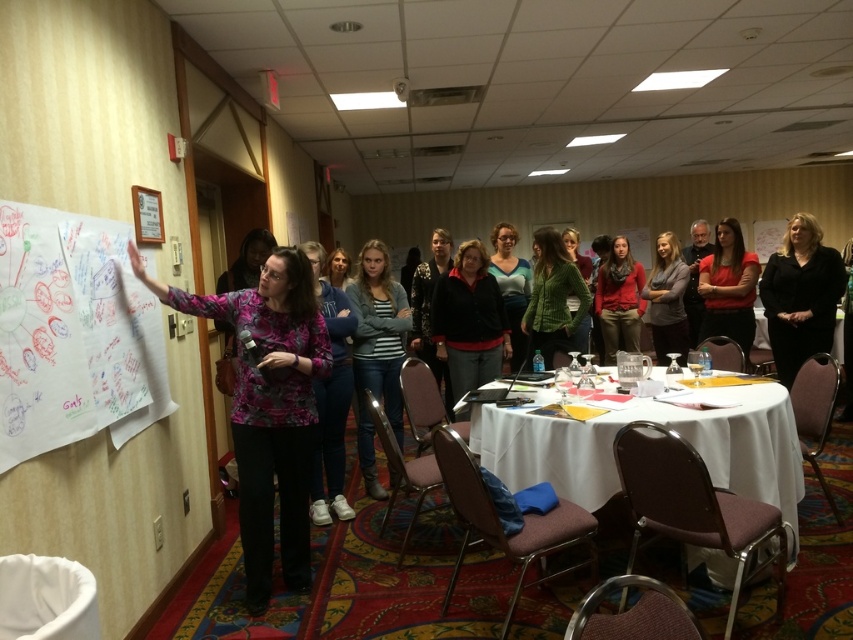
Between matte red sweater at center and matte blue shirt at center, which one appears on the left side from the viewer's perspective?

From the viewer's perspective, matte blue shirt at center appears more on the left side.

Describe the element at coordinates (619, 300) in the screenshot. I see `matte red sweater at center` at that location.

This screenshot has width=853, height=640. I want to click on matte red sweater at center, so click(x=619, y=300).

Between matte red sweater at center and matte pink blouse at center, which one has less height?

matte pink blouse at center is shorter.

What do you see at coordinates (619, 300) in the screenshot?
I see `matte red sweater at center` at bounding box center [619, 300].

At what (x,y) coordinates should I click in order to perform the action: click on matte red sweater at center. Please return your answer as a coordinate pair (x, y). Looking at the image, I should click on (619, 300).

Which is in front, point (726, 294) or point (325, 266)?

Positioned in front is point (325, 266).

Is point (732, 330) less distant than point (340, 253)?

No, it is behind (340, 253).

Find the location of a particular element. This screenshot has width=853, height=640. matte red blouse at center is located at coordinates (728, 288).